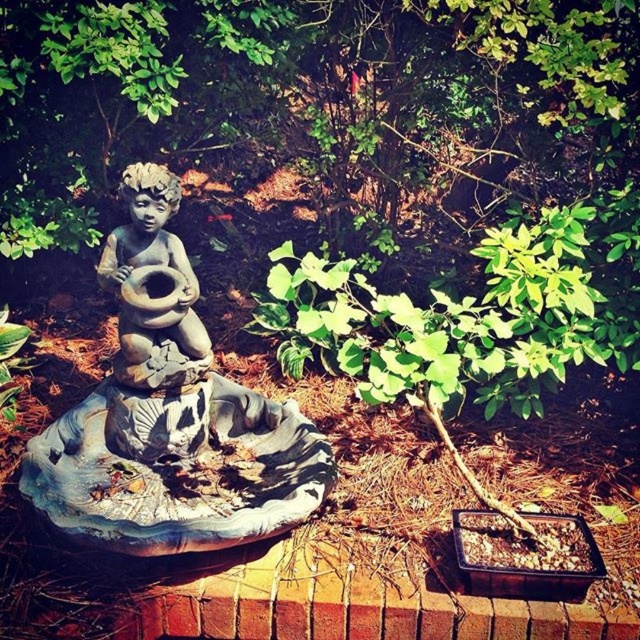
Is green leafy tree at upper center to the right of stone cherub at center from the viewer's perspective?

Yes, green leafy tree at upper center is to the right of stone cherub at center.

Is point (40, 6) positioned after point (129, 307)?

That is True.

You are a GUI agent. You are given a task and a screenshot of the screen. Output one action in this format:
    pyautogui.click(x=<x>, y=<y>)
    Task: Click on the green leafy tree at upper center
    The image size is (640, 640).
    Given the screenshot: What is the action you would take?
    pyautogui.click(x=276, y=74)

Who is shorter, gray stone cherub at center or stone cherub at center?

stone cherub at center

Between gray stone cherub at center and stone cherub at center, which one is positioned higher?

stone cherub at center is above.

This screenshot has width=640, height=640. What are the coordinates of `gray stone cherub at center` in the screenshot? It's located at (170, 417).

This screenshot has height=640, width=640. In order to click on gray stone cherub at center in this screenshot , I will do `click(170, 417)`.

Between green leafy tree at upper center and gray stone cherub at center, which one appears on the left side from the viewer's perspective?

gray stone cherub at center is more to the left.

Is green leafy tree at upper center closer to the viewer compared to gray stone cherub at center?

No, green leafy tree at upper center is further to the viewer.

Is point (625, 16) closer to viewer compared to point (289, 461)?

No, (625, 16) is behind (289, 461).

You are a GUI agent. You are given a task and a screenshot of the screen. Output one action in this format:
    pyautogui.click(x=<x>, y=<y>)
    Task: Click on the green leafy tree at upper center
    The height and width of the screenshot is (640, 640).
    Given the screenshot: What is the action you would take?
    pyautogui.click(x=276, y=74)